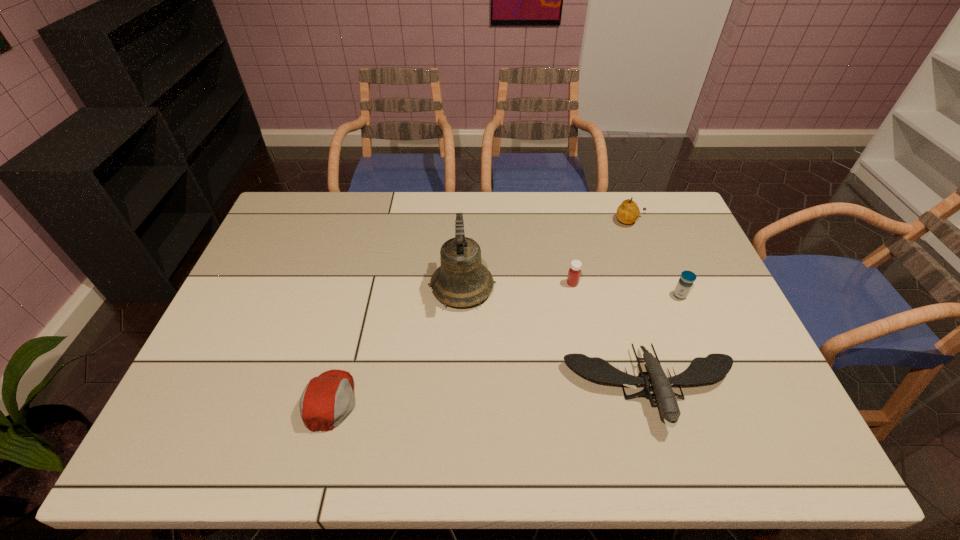
Where is `free space located 0.250m on the right of the left medicine`? This screenshot has height=540, width=960. free space located 0.250m on the right of the left medicine is located at coordinates point(660,284).

Locate an element on the screen. Image resolution: width=960 pixels, height=540 pixels. vacant space located on the back of the nearer medicine is located at coordinates (651, 226).

Identify the location of vacant space situated on the front-facing side of the cap. This screenshot has height=540, width=960. (455, 401).

Where is `object present at the far edge`? object present at the far edge is located at coordinates (628, 212).

This screenshot has height=540, width=960. I want to click on drone that is at the near edge, so click(715, 366).

Identify the location of cap that is at the near edge. tap(328, 399).

The width and height of the screenshot is (960, 540). Identify the location of pear that is at the right edge. (628, 212).

Identify the location of medicine present at the right edge. (685, 283).

Locate an element on the screen. This screenshot has width=960, height=540. drone positioned at the right edge is located at coordinates pos(715,366).

Locate an element on the screen. The image size is (960, 540). object at the far right corner is located at coordinates coord(628,212).